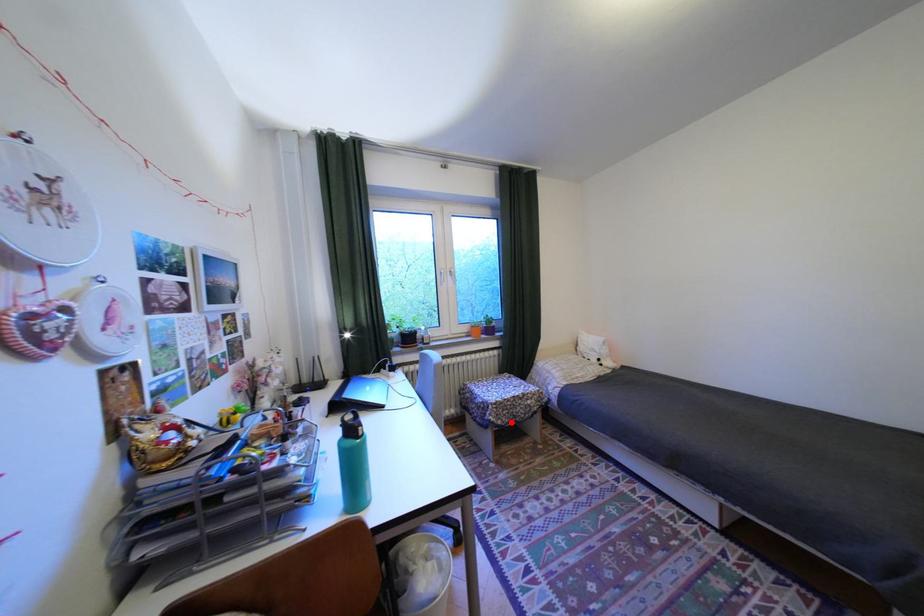
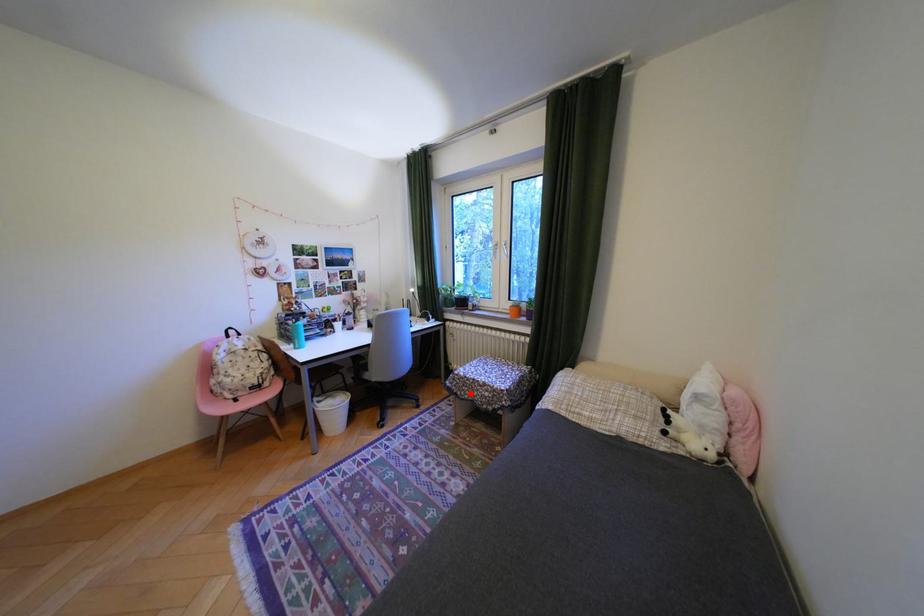
I am providing you with two images of the same scene from different viewpoints. A red point is marked on the first image and another point is marked on the second image. Does the point marked in image1 correspond to the same location as the one in image2?

Yes